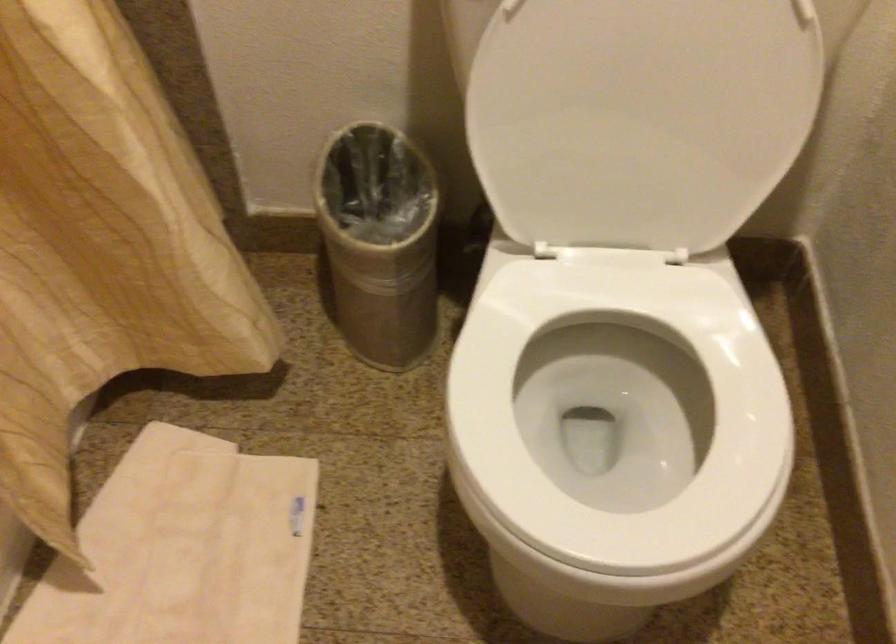
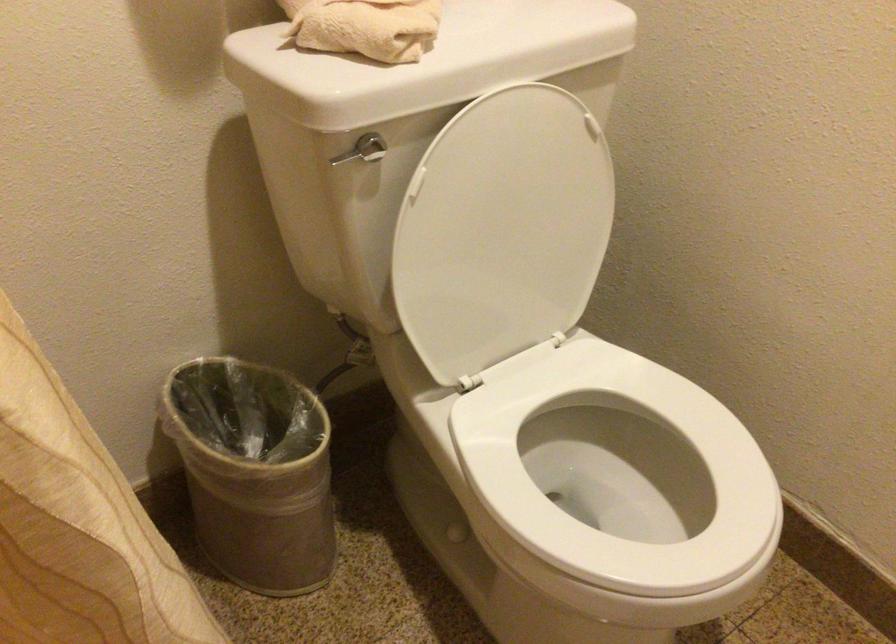
The point at (627, 95) is marked in the first image. Where is the corresponding point in the second image?

(502, 230)